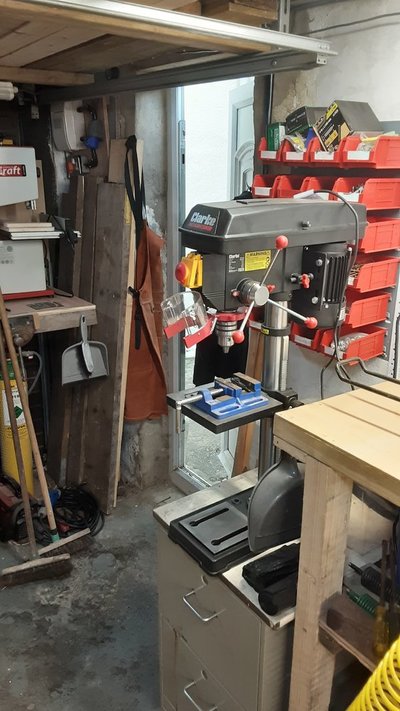
The image size is (400, 711). I want to click on dust pan, so click(x=294, y=515).